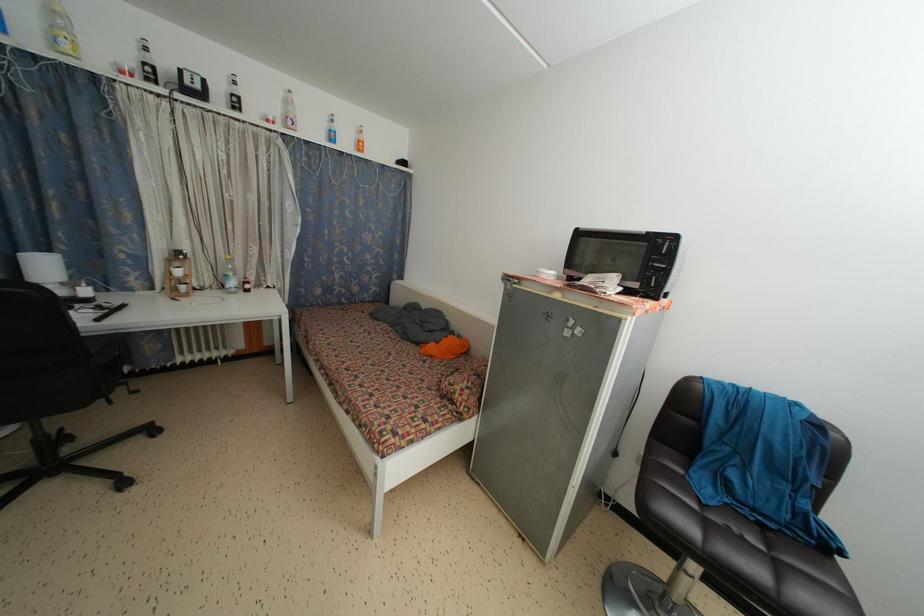
Where is `white table lamp`? The height and width of the screenshot is (616, 924). white table lamp is located at coordinates (44, 270).